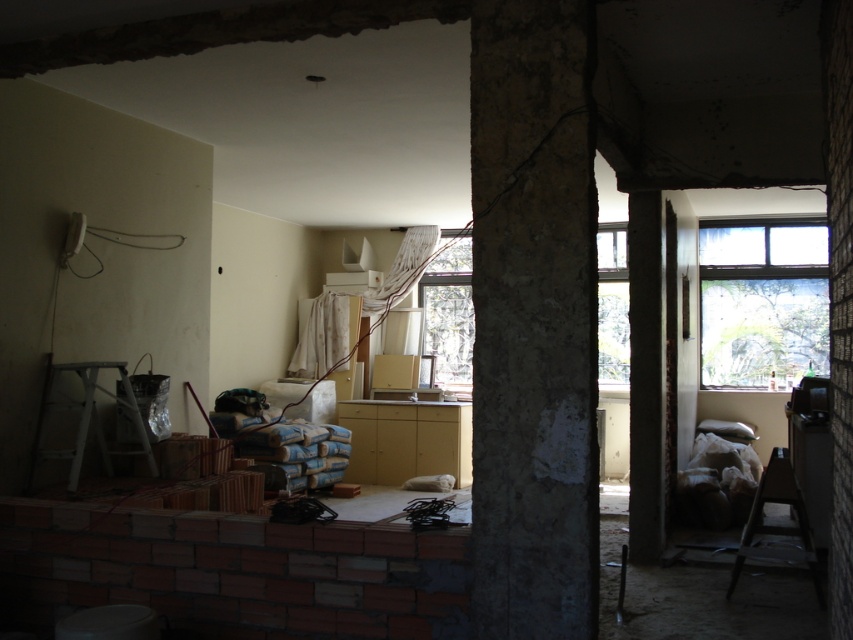
You are standing in the construction area and need to reach a tool located at point (566, 504) and another tool at point (772, 300). Which point is closer to you?

Point (566, 504) is closer to the viewer than point (772, 300), so you should reach for the tool at point (566, 504) first as it is nearer to your current position.

You are a construction worker standing in the room. You need to move a heavy tool from the gray concrete pillar at center to the transparent glass window at upper right. Which object will you pass by first?

You will pass by the gray concrete pillar at center first because it is closer to you than the transparent glass window at upper right.